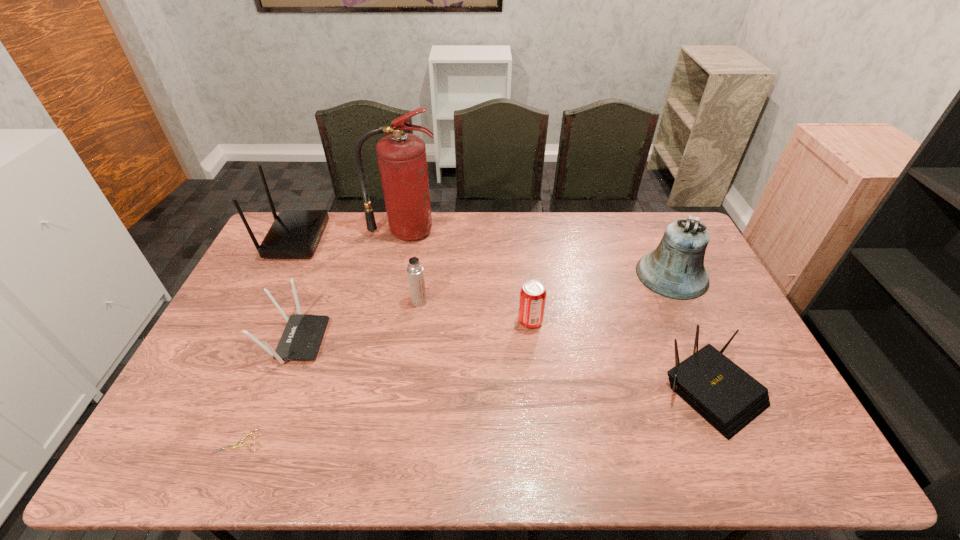
At what (x,y) coordinates should I click in order to perform the action: click on shears located at the near edge. Please return your answer as a coordinate pair (x, y). The image size is (960, 540). Looking at the image, I should click on (238, 444).

What are the coordinates of `router situated at the left edge` in the screenshot? It's located at (295, 233).

You are a GUI agent. You are given a task and a screenshot of the screen. Output one action in this format:
    pyautogui.click(x=<x>, y=<y>)
    Task: Click on the shears located at the left edge
    The image size is (960, 540).
    Given the screenshot: What is the action you would take?
    pyautogui.click(x=238, y=444)

Find the location of a particular element. The image size is (960, 540). bell that is at the right edge is located at coordinates (675, 269).

Find the location of `router that is at the right edge`. router that is at the right edge is located at coordinates tap(726, 396).

At what (x,y) coordinates should I click in order to perform the action: click on object present at the far left corner. Please return your answer as a coordinate pair (x, y). This screenshot has width=960, height=540. Looking at the image, I should click on (295, 233).

Locate an element on the screen. This screenshot has height=540, width=960. object that is at the near left corner is located at coordinates tap(238, 444).

You are a GUI agent. You are given a task and a screenshot of the screen. Output one action in this format:
    pyautogui.click(x=<x>, y=<y>)
    Task: Click on the object present at the near right corner
    
    Given the screenshot: What is the action you would take?
    pyautogui.click(x=726, y=396)

This screenshot has width=960, height=540. What are the coordinates of `vacant region at the far edge of the desktop` in the screenshot? It's located at (483, 238).

Find the location of `vacant space at the near edge of the desktop`. vacant space at the near edge of the desktop is located at coordinates (328, 440).